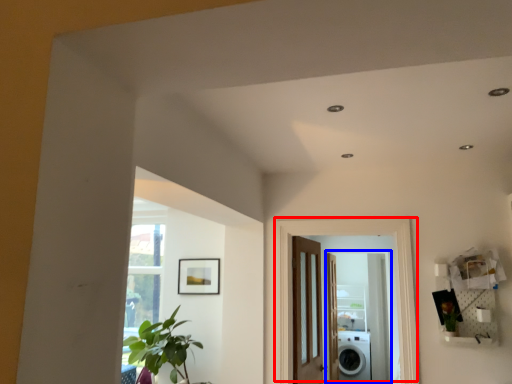
Question: Which point is further to the camera, door (highlighted by a red box) or screen door (highlighted by a blue box)?

Choices:
 (A) door
 (B) screen door

Answer: (B)